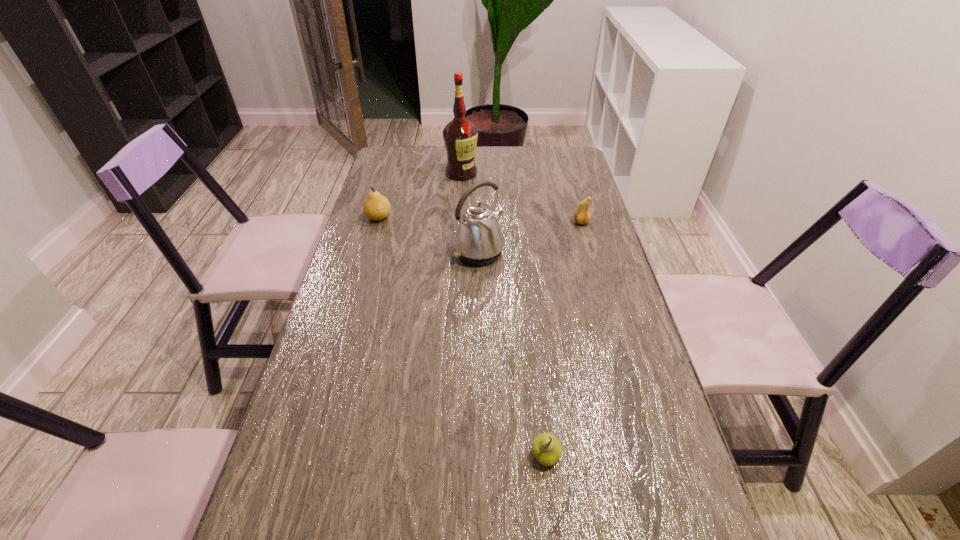
The height and width of the screenshot is (540, 960). Identify the location of alcohol. (460, 136).

Find the location of a particular element. The image size is (960, 540). the farthest object is located at coordinates (460, 136).

You are a GUI agent. You are given a task and a screenshot of the screen. Output one action in this format:
    pyautogui.click(x=<x>, y=<y>)
    Task: Click on the fourth shortest object
    The height and width of the screenshot is (540, 960).
    Given the screenshot: What is the action you would take?
    pyautogui.click(x=478, y=240)

In order to click on kettle in this screenshot , I will do `click(478, 240)`.

Where is `the third shortest object`? the third shortest object is located at coordinates (376, 207).

You are a GUI agent. You are given a task and a screenshot of the screen. Output one action in this format:
    pyautogui.click(x=<x>, y=<y>)
    Task: Click on the tallest pear
    
    Given the screenshot: What is the action you would take?
    pyautogui.click(x=376, y=207)

At what (x,y) coordinates should I click in order to perform the action: click on the rightmost pear. Please return your answer as a coordinate pair (x, y). The height and width of the screenshot is (540, 960). Looking at the image, I should click on (582, 215).

Locate an element on the screen. This screenshot has width=960, height=540. the second object from right to left is located at coordinates (546, 448).

In order to click on the nearest object in this screenshot , I will do `click(546, 448)`.

Locate an element on the screen. blank area located 0.150m on the label of the tallest object is located at coordinates (460, 205).